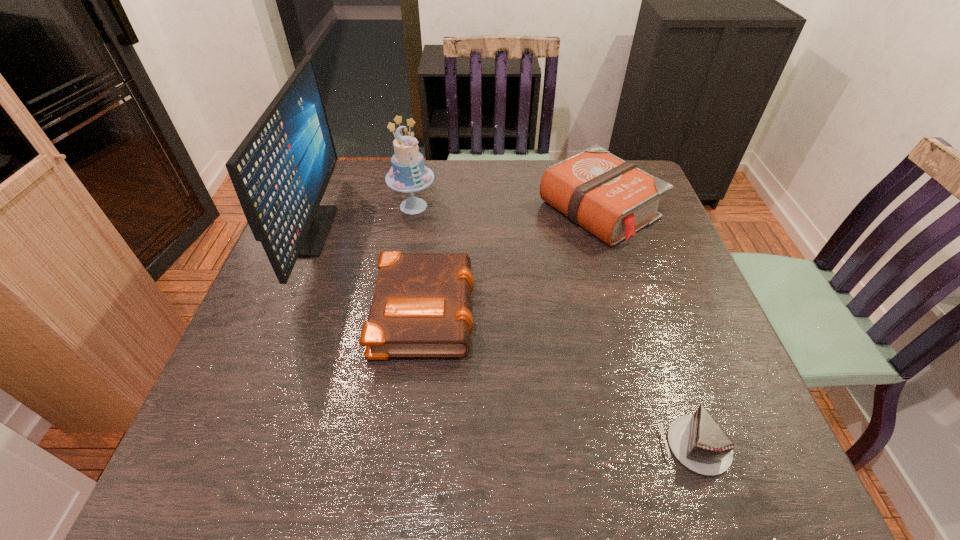
I want to click on vacant position located with a ladder on the side of the fourth shortest object, so click(405, 252).

The image size is (960, 540). I want to click on vacant space located on the left of the right Bible, so click(x=493, y=210).

Identify the location of free space located 0.090m on the spine side of the fourth tallest object. (513, 308).

At what (x,y) coordinates should I click in order to perform the action: click on free space located 0.390m on the back of the nearest object. Please return your answer as a coordinate pair (x, y). The height and width of the screenshot is (540, 960). Looking at the image, I should click on (635, 269).

Where is `computer monitor that is at the far edge`? The image size is (960, 540). computer monitor that is at the far edge is located at coordinates (280, 171).

Find the location of a particular element. This screenshot has height=540, width=960. cake situated at the far edge is located at coordinates (408, 174).

Locate an element on the screen. The height and width of the screenshot is (540, 960). Bible positioned at the far edge is located at coordinates (611, 198).

Find the location of a particular element. object present at the near edge is located at coordinates (697, 441).

You are a GUI agent. You are given a task and a screenshot of the screen. Output one action in this format:
    pyautogui.click(x=<x>, y=<y>)
    Task: Click on the object situated at the left edge
    
    Given the screenshot: What is the action you would take?
    pyautogui.click(x=280, y=171)

You are a GUI agent. You are given a task and a screenshot of the screen. Output one action in this format:
    pyautogui.click(x=<x>, y=<y>)
    Task: Click on the Bible positioned at the right edge
    
    Given the screenshot: What is the action you would take?
    pyautogui.click(x=611, y=198)